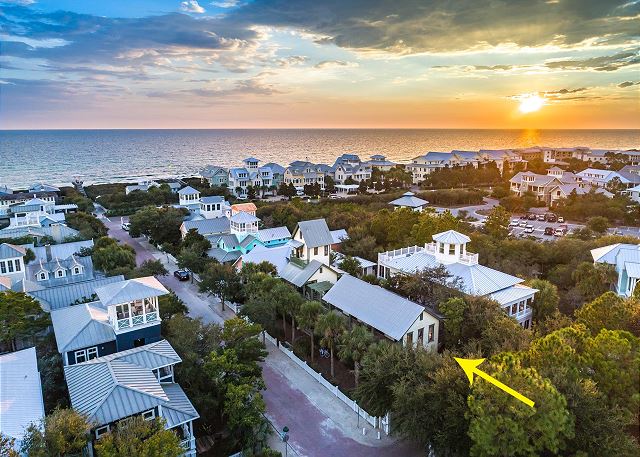
Locate an element on the screen. Image resolution: width=640 pixels, height=457 pixels. windows on home in front of arrow is located at coordinates (409, 338), (418, 336), (429, 334), (420, 320).